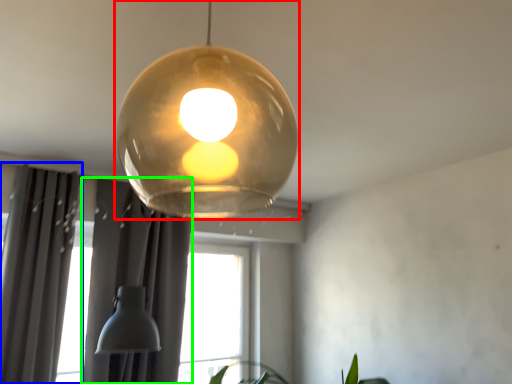
Question: Which object is the closest to the lamp (highlighted by a red box)? Choose among these: curtain (highlighted by a blue box) or curtain (highlighted by a green box).

Choices:
 (A) curtain
 (B) curtain

Answer: (B)